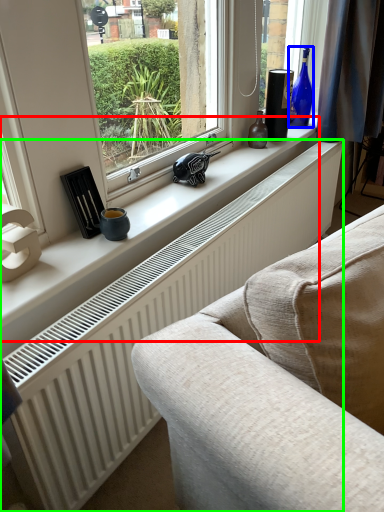
Question: Which object is positioned closest to window sill (highlighted by a red box)? Select from bottle (highlighted by a blue box) and radiator (highlighted by a green box).

Choices:
 (A) bottle
 (B) radiator

Answer: (B)